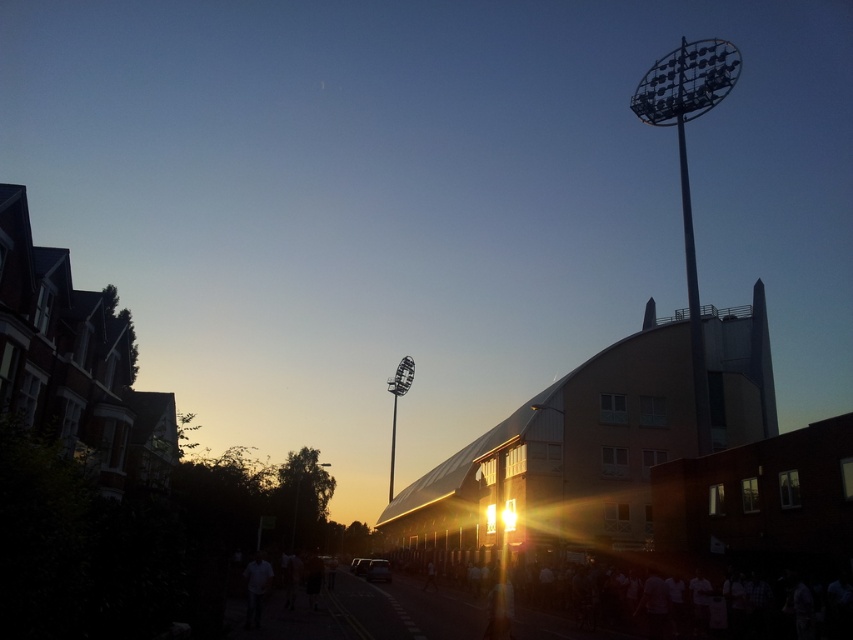
You are a delivery person trying to navigate through the street scene. You need to deliver a package to a location near the yellow painted asphalt at center. However, there is a white matte crowd at lower right blocking your path. Can you go around the crowd to reach the asphalt? Please explain your reasoning based on their positions.

The white matte crowd at lower right is to the right of the yellow painted asphalt at center, so you can go around the crowd by moving to the left side of the asphalt to reach your destination.

You are a delivery drone flying over the street scene described. Your mission is to land on the yellow painted asphalt at center. However, there is a white matte crowd at lower right in your path. Based on the scene, can you safely land without hitting the crowd?

The white matte crowd at lower right is taller than the yellow painted asphalt at center, meaning the crowd is physically higher. Since the drone must descend to land on the asphalt, it would have to pass under the crowd. This might be possible if there is enough vertical clearance between the crowd and the asphalt. However, the description only states the crowd is taller, not the horizontal distance. Without knowing the horizontal separation, we cannot confirm safety. The answer requires more information.

You are standing at the point with coordinates point (691, 602) and want to walk towards the residential buildings on the left. Which direction should you go?

The residential buildings on the left are located to the left of your current position at point (691, 602). To walk towards them, you should go to the left.